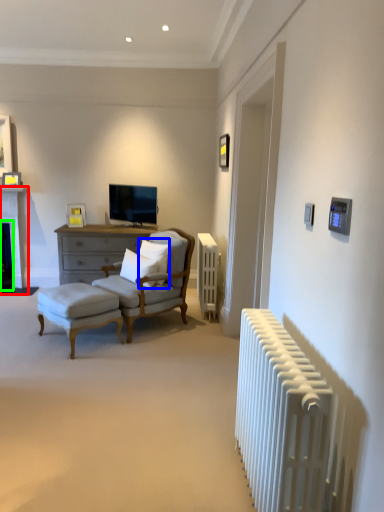
Question: Considering the real-world distances, which object is closest to fireplace (highlighted by a red box)? pillow (highlighted by a blue box) or fireplace (highlighted by a green box).

Choices:
 (A) pillow
 (B) fireplace

Answer: (B)